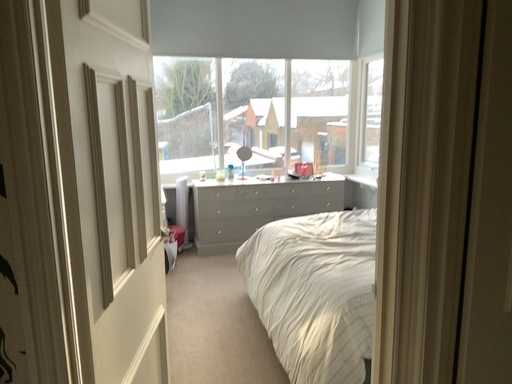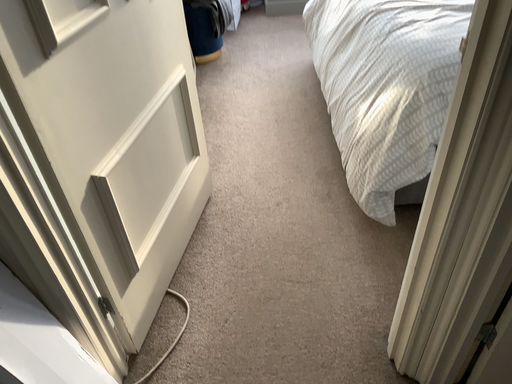
Question: How did the camera likely rotate when shooting the video?

Choices:
 (A) rotated right
 (B) rotated left

Answer: (B)